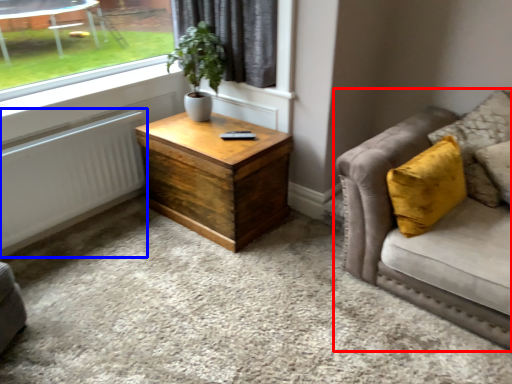
Question: Which object is further to the camera taking this photo, studio couch (highlighted by a red box) or radiator (highlighted by a blue box)?

Choices:
 (A) studio couch
 (B) radiator

Answer: (B)